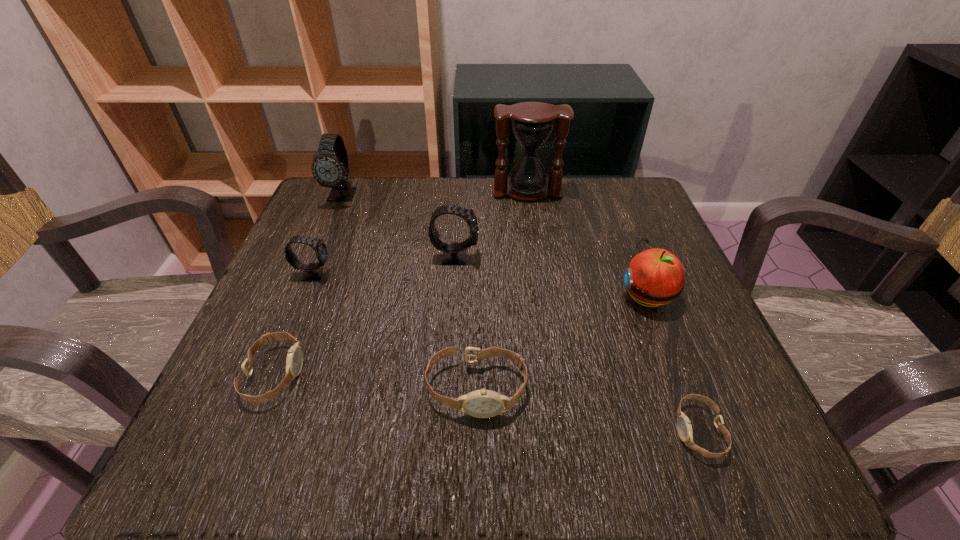
Locate an element on the screen. The height and width of the screenshot is (540, 960). object that is at the near right corner is located at coordinates (684, 427).

You are a GUI agent. You are given a task and a screenshot of the screen. Output one action in this format:
    pyautogui.click(x=<x>, y=<y>)
    Task: Click on the vacant space at the far edge of the desktop
    Image resolution: width=960 pixels, height=540 pixels.
    Given the screenshot: What is the action you would take?
    pyautogui.click(x=432, y=191)

You are a GUI agent. You are given a task and a screenshot of the screen. Output one action in this format:
    pyautogui.click(x=<x>, y=<y>)
    Task: Click on the blank space at the near edge of the desktop
    Image resolution: width=960 pixels, height=540 pixels.
    Given the screenshot: What is the action you would take?
    pyautogui.click(x=517, y=413)

Locate an element on the screen. The width and height of the screenshot is (960, 540). free location at the left edge is located at coordinates (280, 363).

The width and height of the screenshot is (960, 540). In the image, there is a desktop. Identify the location of vacant region at the far right corner. click(598, 213).

Locate an element on the screen. free space at the near right corner of the desktop is located at coordinates (726, 444).

The width and height of the screenshot is (960, 540). Find the location of `unoccupied position between the hourglass and the third farthest object`. unoccupied position between the hourglass and the third farthest object is located at coordinates (492, 224).

Image resolution: width=960 pixels, height=540 pixels. Identify the location of vacant space that is in between the fourth tallest watch and the second tallest watch. 466,323.

Where is `vacant space in between the farthest gray watch and the nearest gray watch`? This screenshot has width=960, height=540. vacant space in between the farthest gray watch and the nearest gray watch is located at coordinates (328, 234).

I want to click on free area in between the second beige watch from left to right and the apple, so click(562, 342).